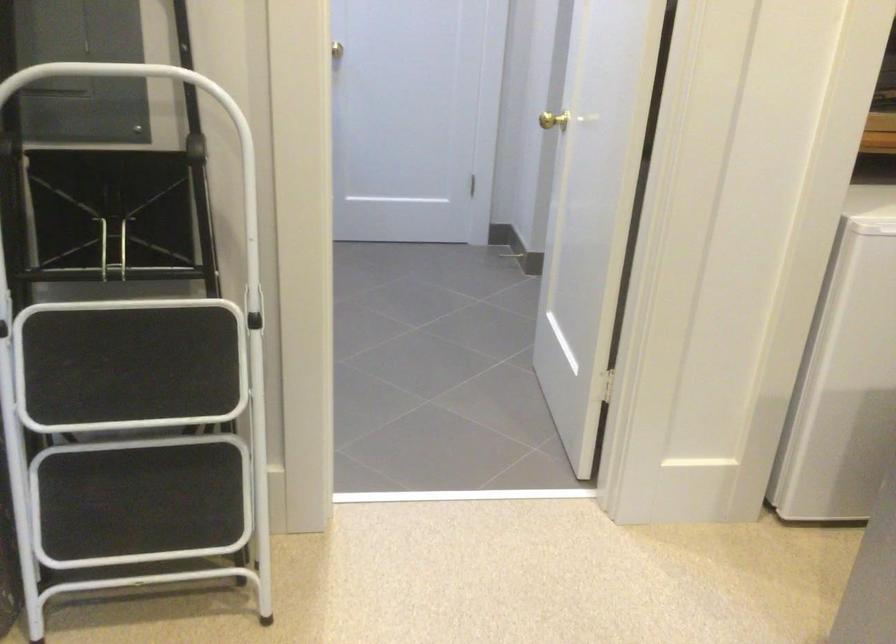
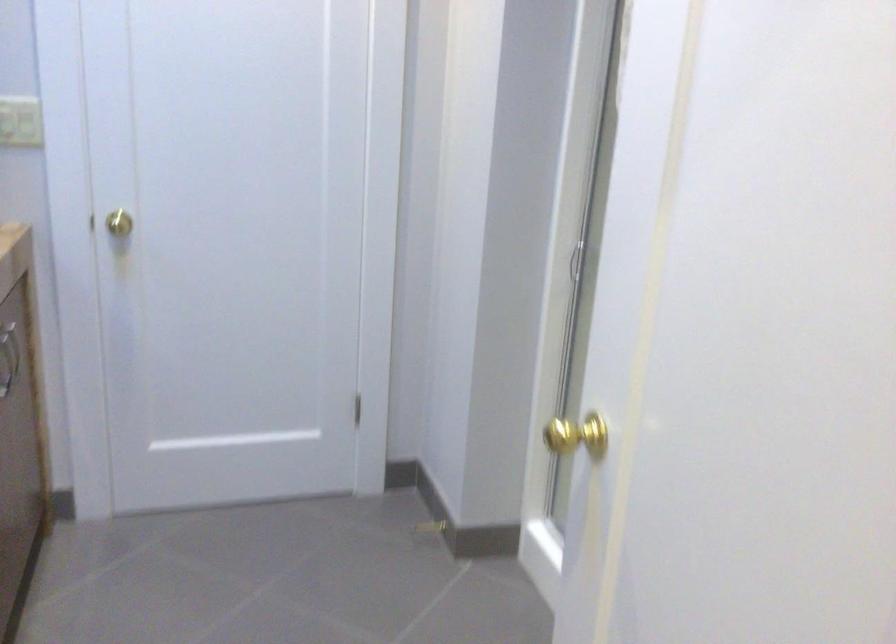
Question: The images are taken continuously from a first-person perspective. In which direction are you moving?

Choices:
 (A) Left
 (B) Right
 (C) Forward
 (D) Backward

Answer: (C)